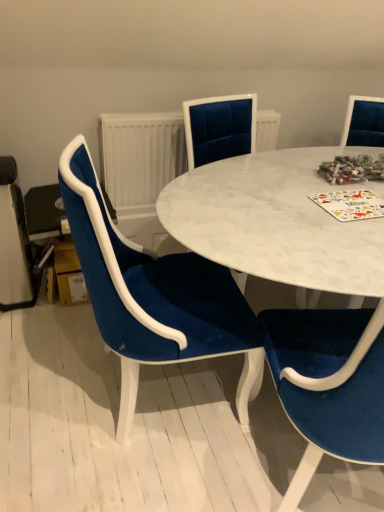
Identify the location of free location to the left of velvet blue chair at left, which appears as the second chair when viewed from the right. (41, 375).